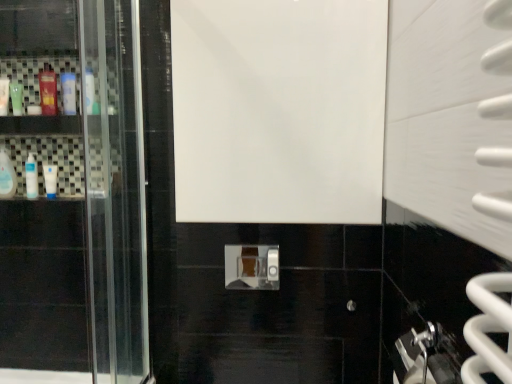
Question: Considering their positions, is white glossy bottle at left, the 1th mouthwash from the right, located in front of or behind clear plastic bottle at left, the 6th mouthwash from the right?

Choices:
 (A) behind
 (B) front

Answer: (B)

Question: In terms of size, does white glossy bottle at left, which is the sixth mouthwash from left to right, appear bigger or smaller than clear plastic bottle at left, which is the first mouthwash in left-to-right order?

Choices:
 (A) big
 (B) small

Answer: (B)

Question: Based on their relative distances, which object is nearer to the clear plastic bottle at left, which is the first mouthwash in left-to-right order?

Choices:
 (A) white glossy tube at left, the 4th mouthwash in the left-to-right sequence
 (B) green matte bottle at left, the second mouthwash when ordered from left to right
 (C) white glossy door at center
 (D) white glossy bottle at left, the 1th mouthwash from the right
 (E) white glossy bottle at left, positioned as the third mouthwash in left-to-right order

Answer: (E)

Question: Considering the real-world distances, which object is closest to the green matte bottle at left, which is the fifth mouthwash from right to left?

Choices:
 (A) white glossy door at center
 (B) white glossy bottle at left, acting as the fourth mouthwash starting from the right
 (C) clear plastic bottle at left, the 6th mouthwash from the right
 (D) translucent plastic mouthwash at upper left, acting as the fifth mouthwash starting from the left
 (E) white glossy tube at left, which appears as the 3th mouthwash when viewed from the right

Answer: (D)